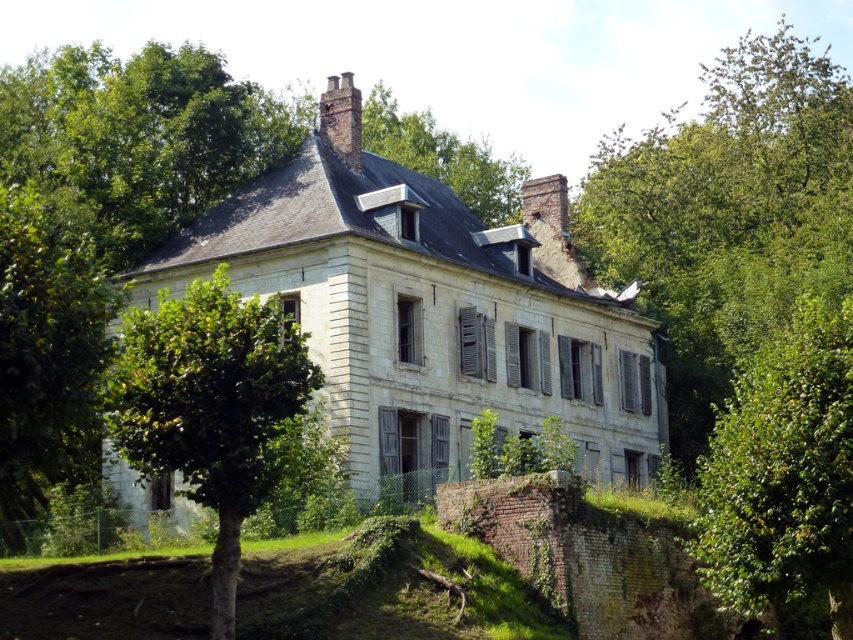
Question: Is the position of white stone mansion at center less distant than that of green leafy tree at center?

Choices:
 (A) no
 (B) yes

Answer: (A)

Question: Is white stone mansion at center bigger than green leafy tree at right?

Choices:
 (A) no
 (B) yes

Answer: (B)

Question: Which is nearer to the green leafy tree at right?

Choices:
 (A) green leafy tree at left
 (B) green leafy tree at center
 (C) white stone mansion at center
 (D) brick chimney at upper center

Answer: (C)

Question: Which point is closer to the camera?

Choices:
 (A) green leafy tree at right
 (B) brick chimney at upper center

Answer: (A)

Question: Which object appears closest to the camera in this image?

Choices:
 (A) brick chimney at upper center
 (B) green leafy tree at center
 (C) white stone mansion at center
 (D) green leafy tree at left

Answer: (D)

Question: Can you confirm if green leafy tree at center is positioned above green leafy tree at left?

Choices:
 (A) yes
 (B) no

Answer: (B)